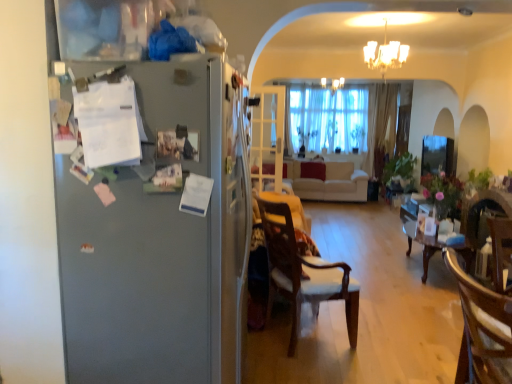
Identify the location of free location in front of wooden chair at center, which is the first chair from back to front. Image resolution: width=512 pixels, height=384 pixels. (312, 368).